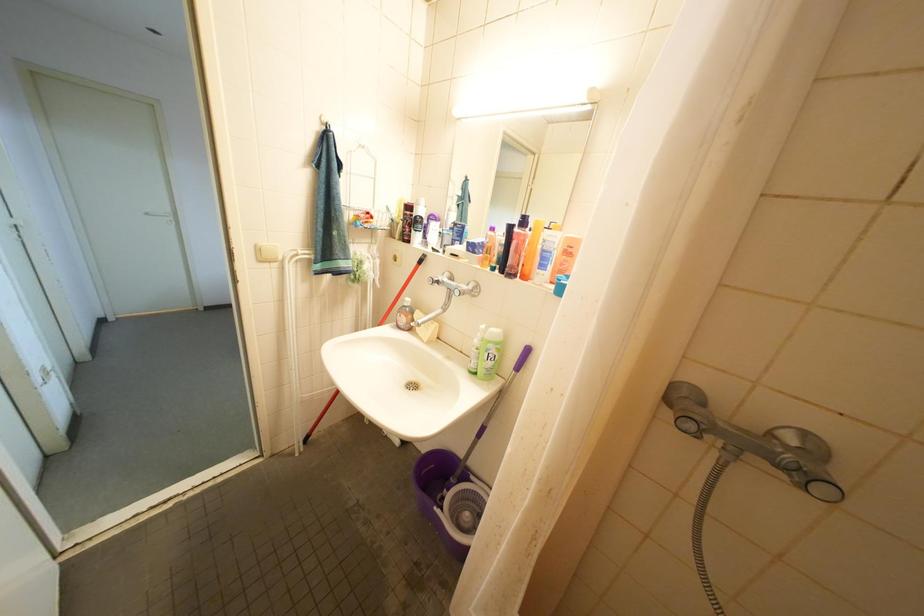
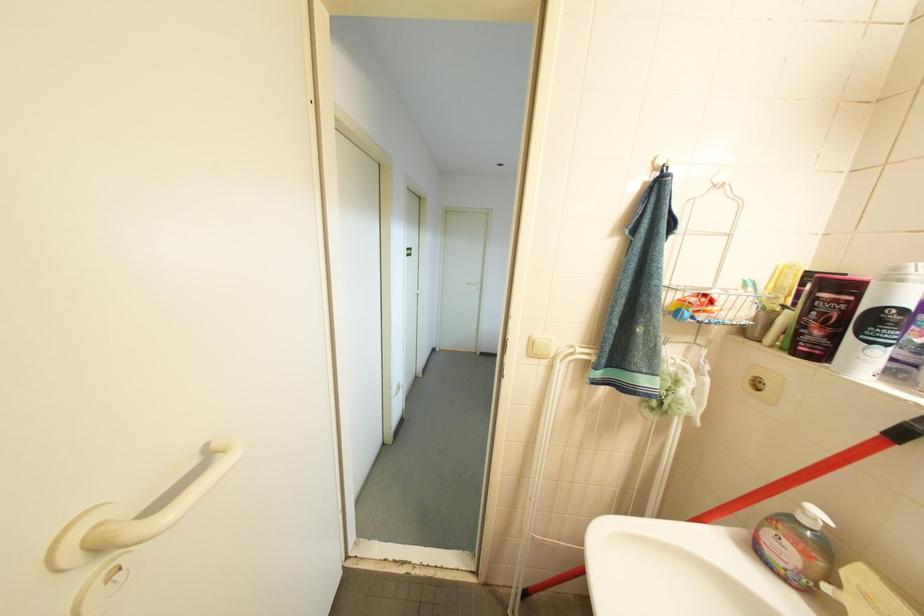
Question: How did the camera likely rotate?

Choices:
 (A) Left
 (B) Right
 (C) Up
 (D) Down

Answer: (A)